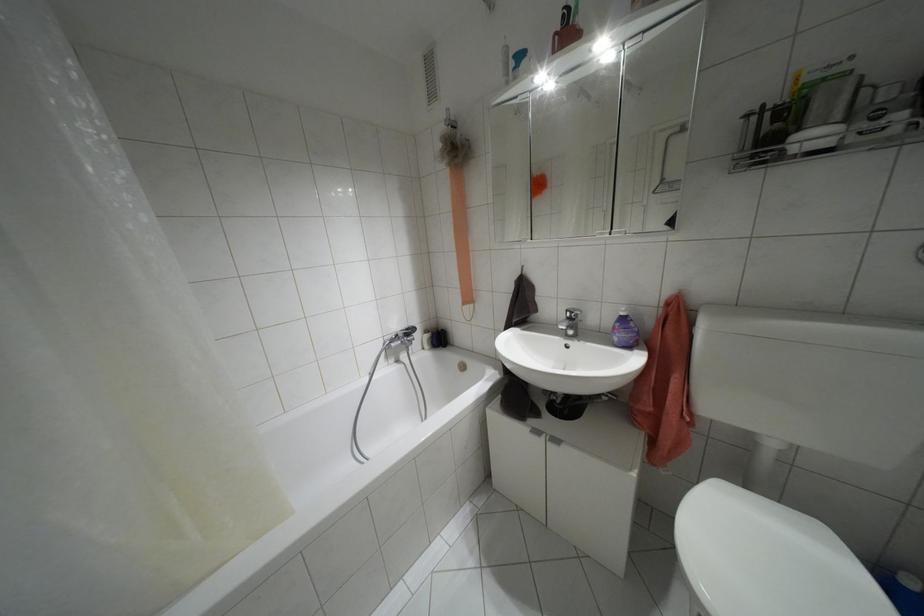
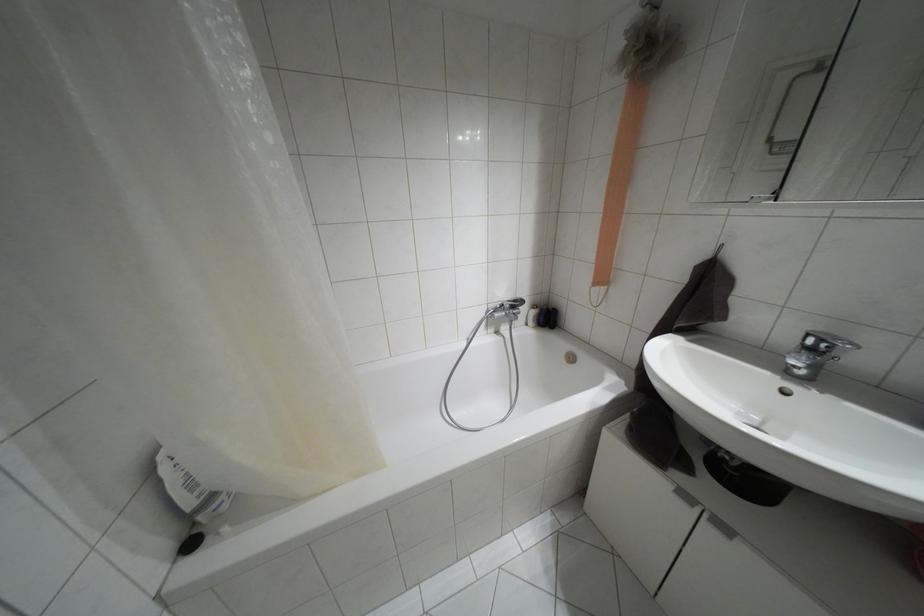
Locate, in the second image, the point that corresponds to pixel 536 431 in the first image.

(685, 496)